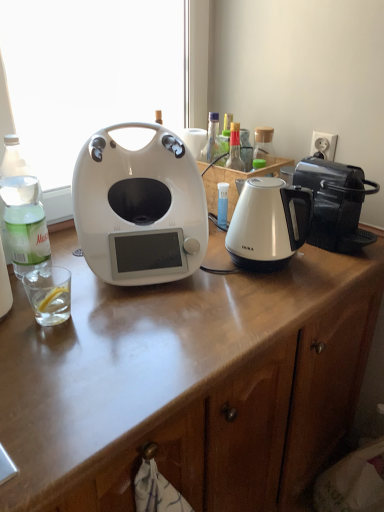
I want to click on vacant area on top of white glossy kettle at center-right (from a real-world perspective), so click(x=270, y=188).